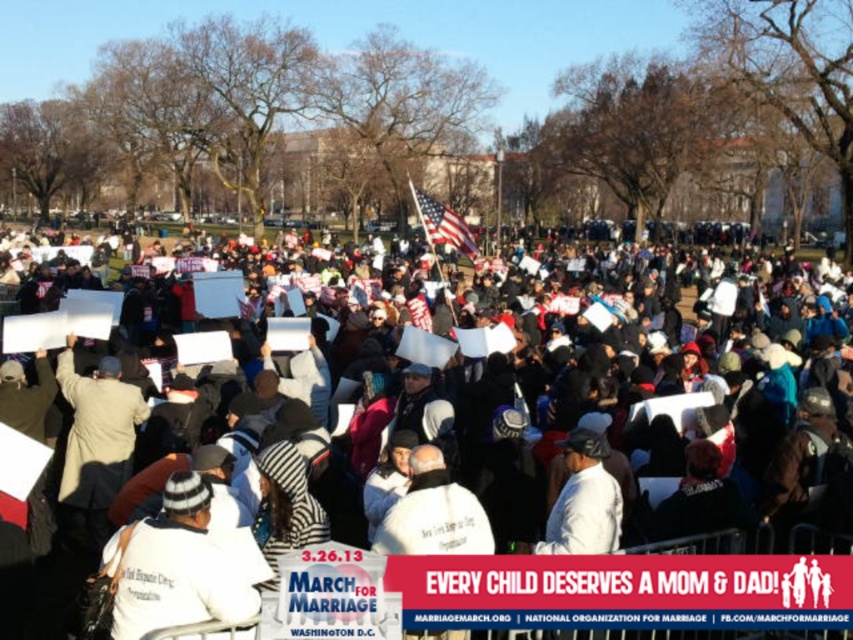
Which is above, white fleece jacket at lower left or white matte jacket at center?

Positioned higher is white matte jacket at center.

This screenshot has height=640, width=853. Describe the element at coordinates (183, 564) in the screenshot. I see `white fleece jacket at lower left` at that location.

Is point (167, 600) closer to camera compared to point (584, 490)?

That is True.

The image size is (853, 640). Find the location of `white fleece jacket at lower left`. white fleece jacket at lower left is located at coordinates (183, 564).

Can you confirm if white paper signs at center is thinner than white matte jacket at center?

Incorrect, white paper signs at center's width is not less than white matte jacket at center's.

Is point (779, 376) more distant than point (558, 509)?

That is True.

Does point (670, 268) come behind point (601, 532)?

Yes, point (670, 268) is farther from viewer.

You are a GUI agent. You are given a task and a screenshot of the screen. Output one action in this format:
    pyautogui.click(x=<x>, y=<y>)
    Task: Click on the white paper signs at center
    The width and height of the screenshot is (853, 640).
    Given the screenshot: What is the action you would take?
    pyautogui.click(x=622, y=433)

Who is more distant from viewer, (523, 483) or (199, 584)?

The point (523, 483) is behind.

Measure the distance between white paper signs at center and camera.

white paper signs at center and camera are 8.69 meters apart from each other.

Identify the location of white paper signs at center. (622, 433).